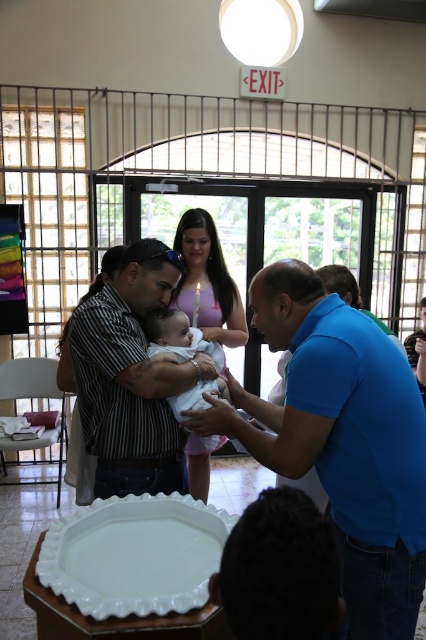
Does blue smooth shirt at center have a smaller size compared to striped shirt at center?

No, blue smooth shirt at center is not smaller than striped shirt at center.

Who is lower down, blue smooth shirt at center or striped shirt at center?

blue smooth shirt at center is lower down.

Describe the element at coordinates (342, 440) in the screenshot. I see `blue smooth shirt at center` at that location.

The image size is (426, 640). I want to click on blue smooth shirt at center, so click(342, 440).

Is point (307, 324) positioned after point (184, 349)?

No.

Which of these two, blue smooth shirt at center or white soft fabric baby at center, stands taller?

blue smooth shirt at center is taller.

Who is more forward, (290,266) or (204,342)?

A: Point (290,266)

Where is `blue smooth shirt at center`? blue smooth shirt at center is located at coordinates (342, 440).

Between striped shirt at center and white soft fabric baby at center, which one has less height?

white soft fabric baby at center

Who is more distant from viewer, (154,362) or (210,390)?

Positioned behind is point (210,390).

Image resolution: width=426 pixels, height=640 pixels. What do you see at coordinates (131, 378) in the screenshot?
I see `striped shirt at center` at bounding box center [131, 378].

I want to click on striped shirt at center, so click(x=131, y=378).